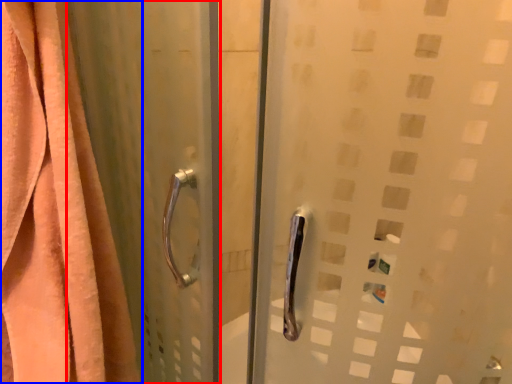
Question: Which object appears farthest to the camera in this image, screen door (highlighted by a red box) or curtain (highlighted by a blue box)?

Choices:
 (A) screen door
 (B) curtain

Answer: (B)